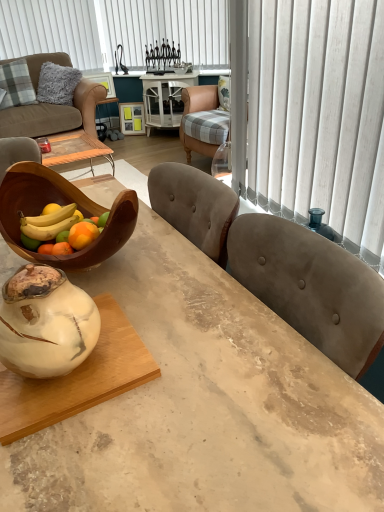
You are a GUI agent. You are given a task and a screenshot of the screen. Output one action in this format:
    pyautogui.click(x=<x>, y=<y>)
    Task: Click on the vacant area that is in front of white marble coffee table at lower left
    This screenshot has height=512, width=384.
    Given the screenshot: What is the action you would take?
    pyautogui.click(x=99, y=458)